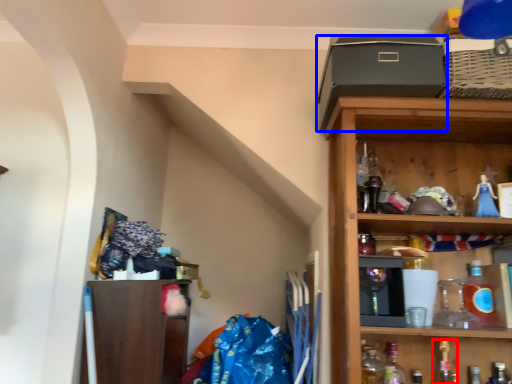
Question: Which object is further to the camera taking this photo, bottle (highlighted by a red box) or box (highlighted by a blue box)?

Choices:
 (A) bottle
 (B) box

Answer: (A)